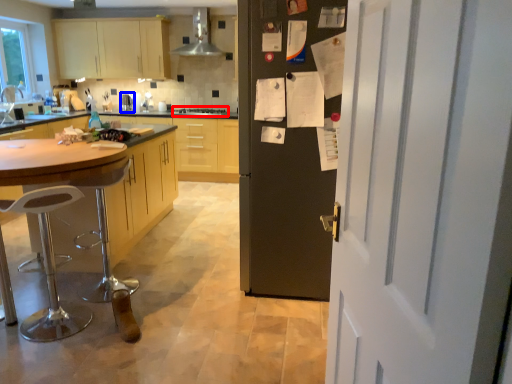
Question: Which object is further to the camera taking this photo, stove (highlighted by a red box) or appliance (highlighted by a blue box)?

Choices:
 (A) stove
 (B) appliance

Answer: (B)